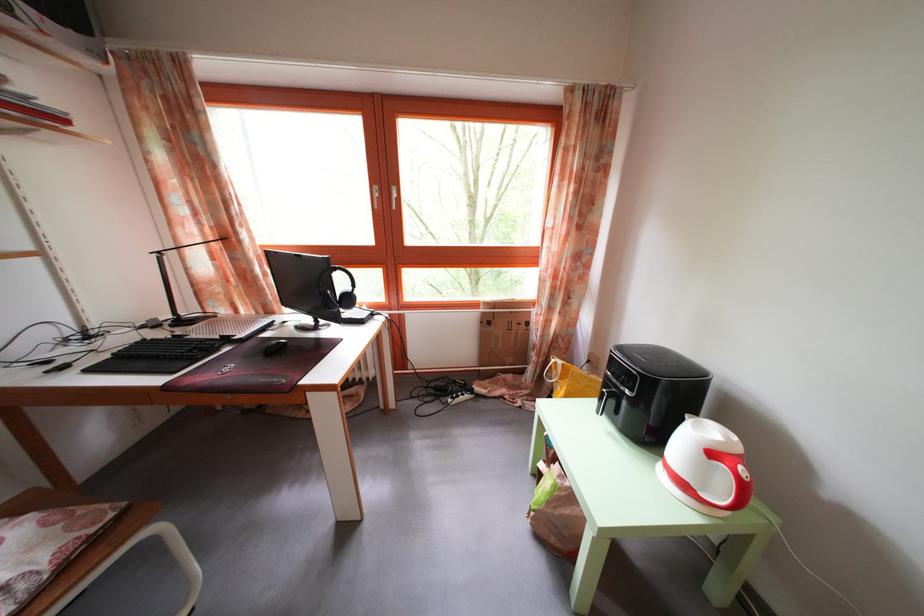
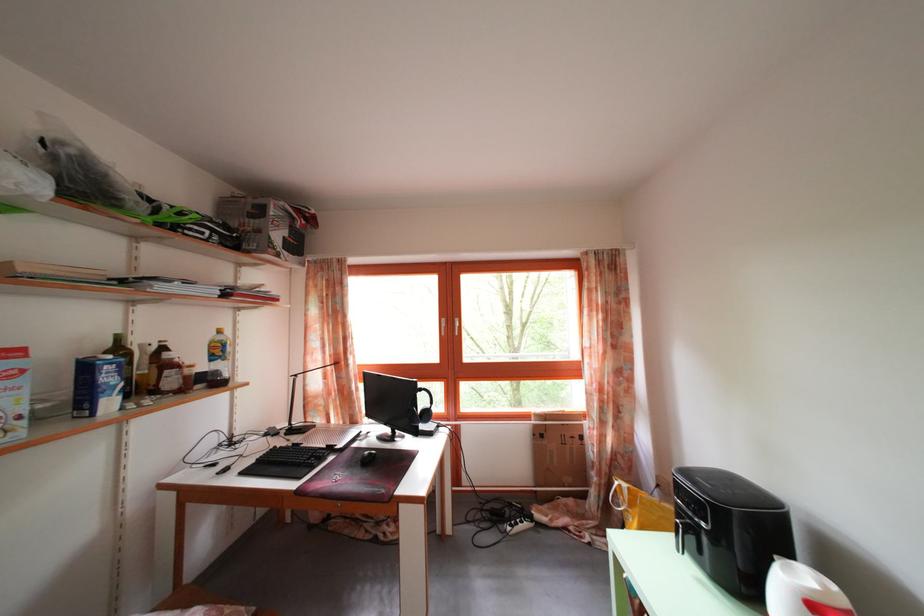
The point at (181, 365) is marked in the first image. Where is the corresponding point in the second image?

(307, 472)